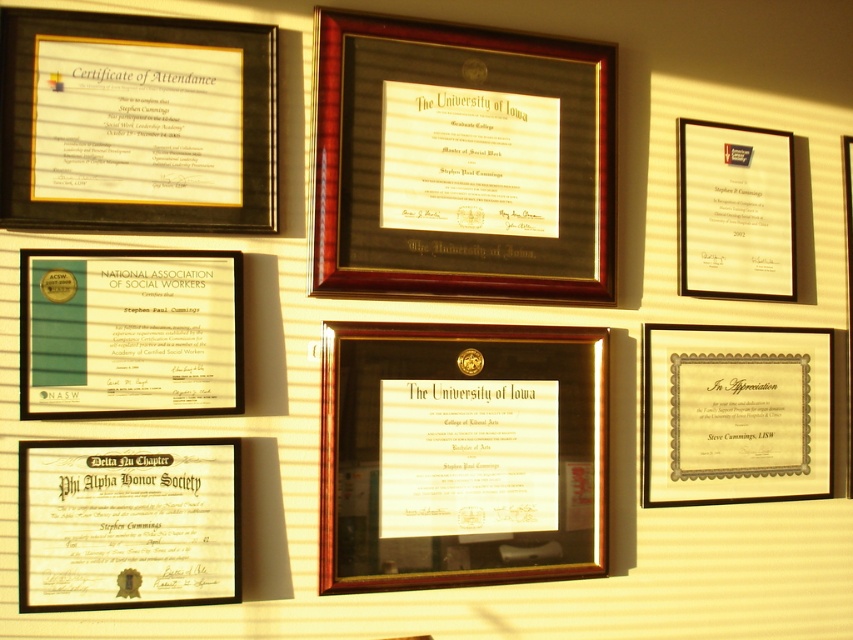
Question: Is mahogany wood frame at upper center in front of gold paper certificate at center?

Choices:
 (A) no
 (B) yes

Answer: (B)

Question: Estimate the real-world distances between objects in this image. Which object is farther from the matte gold certificate at lower left?

Choices:
 (A) green paper certificate at lower left
 (B) matte black certificate at upper right
 (C) glossy paper certificate at center

Answer: (B)

Question: Does black matte certificate at upper left appear on the left side of gold/metallic frame at center?

Choices:
 (A) no
 (B) yes

Answer: (B)

Question: Is matte black certificate at upper right further to camera compared to gold paper certificate at center?

Choices:
 (A) yes
 (B) no

Answer: (A)

Question: Which point is closer to the camera?

Choices:
 (A) glossy paper certificate at center
 (B) matte black certificate at upper right
 (C) mahogany wood frame at upper center
 (D) gold metallic certificate at lower right

Answer: (C)

Question: Which object is positioned farthest from the green paper certificate at lower left?

Choices:
 (A) gold metallic certificate at lower right
 (B) mahogany wood frame at upper center
 (C) matte gold certificate at lower left

Answer: (A)